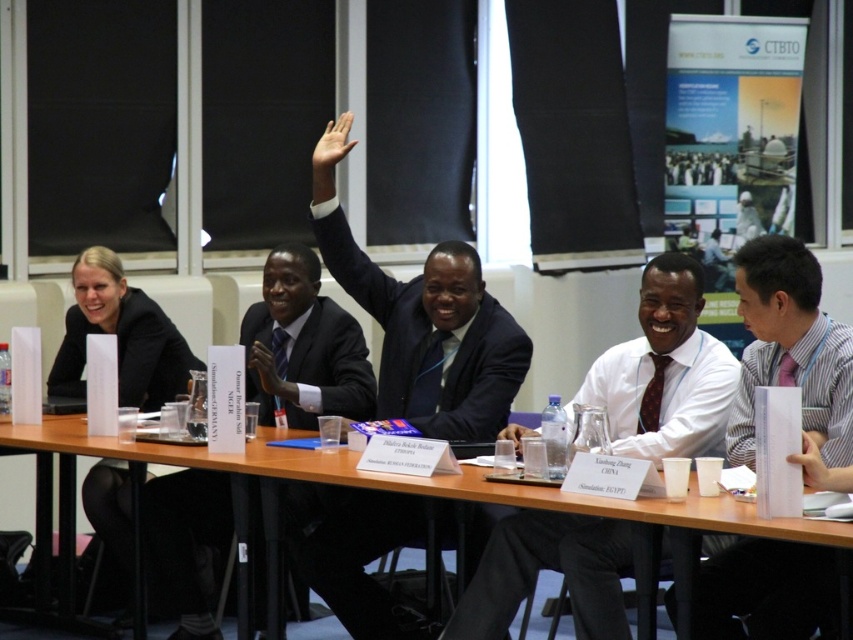
You are a photographer at the event and want to capture a photo of the dark blue suit at center and the matte black glove at center. Since you want to ensure both are in focus, which object should you focus on first to account for their sizes?

The dark blue suit at center is much taller than the matte black glove at center, so you should focus on the dark blue suit at center first as it is larger and requires more precise focus.

In the scene of a formal meeting with people seated around a long wooden table, where is the dark blue suit at center located in terms of coordinates?

The dark blue suit at center is located at coordinates point (x=430, y=332).